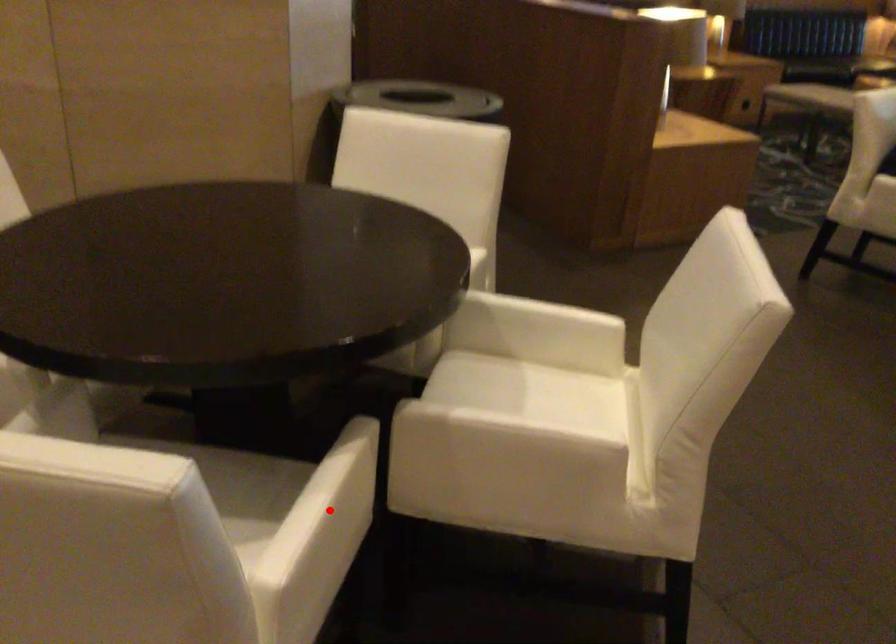
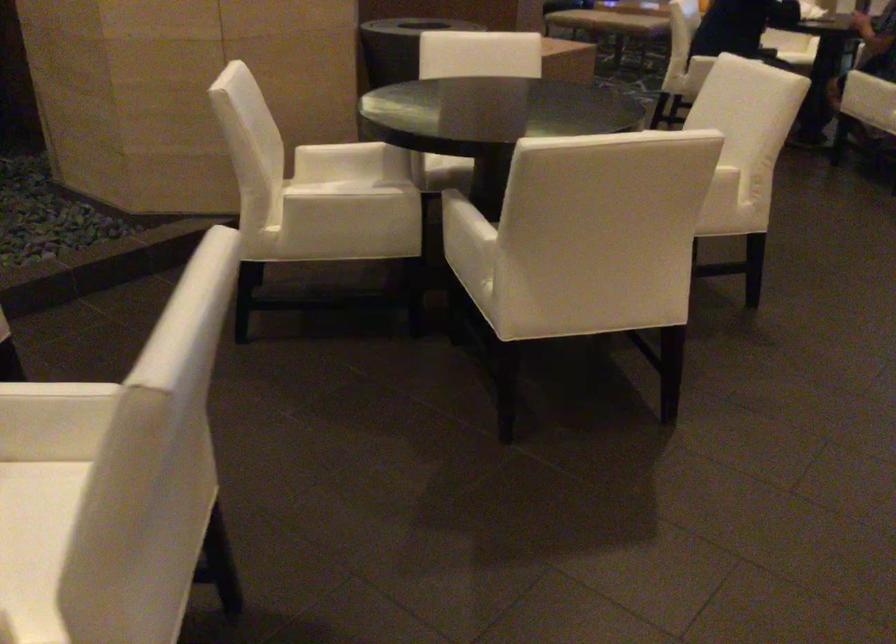
Question: I am providing you with two images of the same scene from different viewpoints. A red point is marked on the first image. Is the red point's position out of view in image 2?

Choices:
 (A) Yes
 (B) No

Answer: (A)